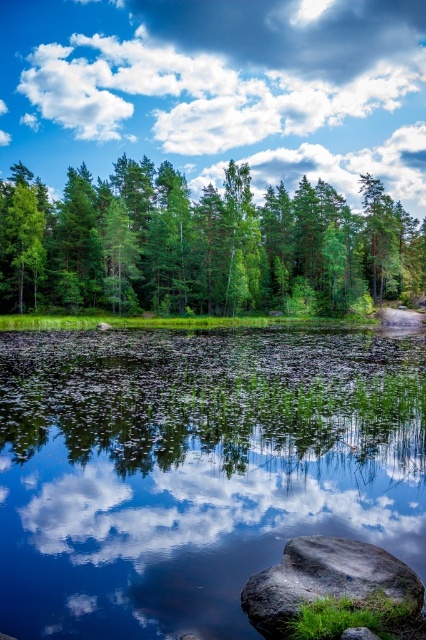
Question: From the image, what is the correct spatial relationship of transparent glass lake at center in relation to white fluffy cloud at upper center?

Choices:
 (A) left
 (B) right

Answer: (B)

Question: Is white fluffy cloud at upper center below green leafy trees at center?

Choices:
 (A) yes
 (B) no

Answer: (B)

Question: Is transparent glass lake at center smaller than white fluffy cloud at upper center?

Choices:
 (A) no
 (B) yes

Answer: (B)

Question: Which object is farther from the camera taking this photo?

Choices:
 (A) gray smooth rock at lower right
 (B) transparent glass lake at center

Answer: (B)

Question: Which of the following is the closest to the observer?

Choices:
 (A) coord(250,596)
 (B) coord(226,243)

Answer: (A)

Question: Which point is farther to the camera?

Choices:
 (A) white fluffy cloud at upper center
 (B) green leafy trees at center

Answer: (A)